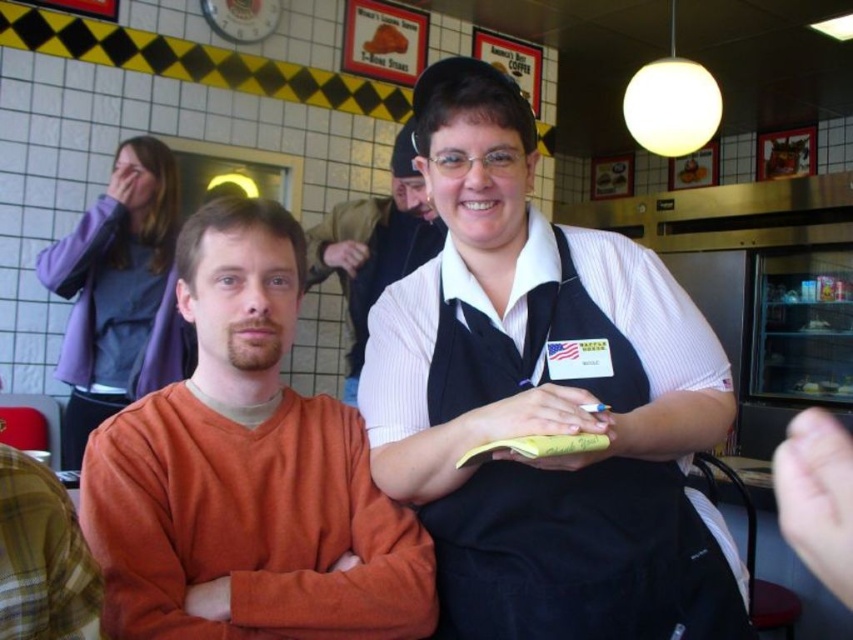
Can you confirm if matte orange shirt at center is positioned to the left of orange cotton shirt at center?

In fact, matte orange shirt at center is to the right of orange cotton shirt at center.

Between point (675, 449) and point (250, 499), which one is positioned behind?

Positioned behind is point (250, 499).

Where is `matte orange shirt at center`? Image resolution: width=853 pixels, height=640 pixels. matte orange shirt at center is located at coordinates (544, 401).

Consider the image. Can you confirm if matte orange shirt at center is smaller than white ribbed sweater at center?

Correct, matte orange shirt at center occupies less space than white ribbed sweater at center.

I want to click on matte orange shirt at center, so click(544, 401).

Can you confirm if orange cotton shirt at center is thinner than white ribbed sweater at center?

Yes, orange cotton shirt at center is thinner than white ribbed sweater at center.

Find the location of a particular element. Image resolution: width=853 pixels, height=640 pixels. orange cotton shirt at center is located at coordinates (247, 472).

Measure the distance between orange cotton shirt at center and camera.

They are 34.67 inches apart.

Identify the location of orange cotton shirt at center. 247,472.